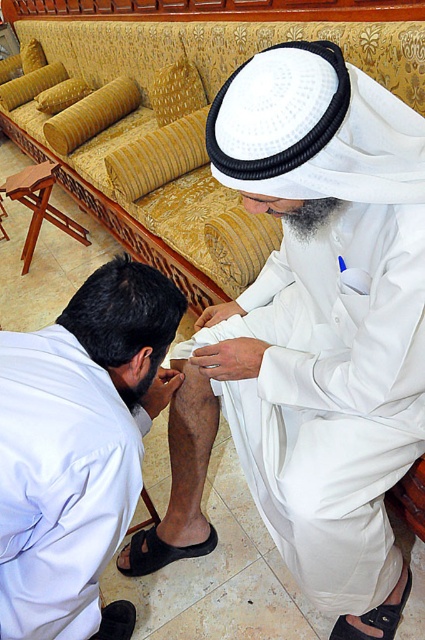
Does white matte cloth at center have a larger size compared to black leather sandal at lower right?

Indeed, white matte cloth at center has a larger size compared to black leather sandal at lower right.

Consider the image. Does white matte cloth at center have a lesser width compared to black leather sandal at lower right?

In fact, white matte cloth at center might be wider than black leather sandal at lower right.

I want to click on white matte cloth at center, so click(314, 324).

Does black suede sandal at lower center appear on the right side of black leather sandal at lower left?

Correct, you'll find black suede sandal at lower center to the right of black leather sandal at lower left.

Who is positioned more to the right, black suede sandal at lower center or black leather sandal at lower left?

Positioned to the right is black suede sandal at lower center.

Which is behind, point (155, 568) or point (116, 630)?

Positioned behind is point (155, 568).

Locate an element on the screen. black suede sandal at lower center is located at coordinates (161, 552).

Can you confirm if white matte cloth at center is taller than black suede sandal at lower center?

Correct, white matte cloth at center is much taller as black suede sandal at lower center.

Who is positioned more to the right, white matte cloth at center or black suede sandal at lower center?

white matte cloth at center

Which is in front, point (282, 385) or point (133, 538)?

Point (282, 385) is in front.

This screenshot has width=425, height=640. In order to click on white matte cloth at center in this screenshot , I will do `click(314, 324)`.